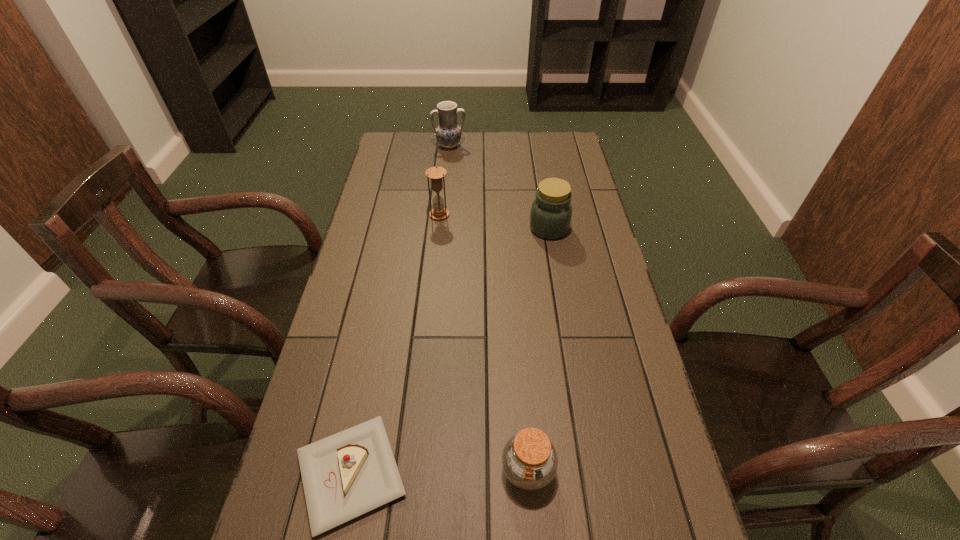
Where is `vacant area in the image that satisfies the following two spatial constraints: 1. on the front side of the taller jar; 2. on the left side of the pottery`? vacant area in the image that satisfies the following two spatial constraints: 1. on the front side of the taller jar; 2. on the left side of the pottery is located at coordinates (442, 228).

This screenshot has width=960, height=540. Find the location of `free space that satisfies the following two spatial constraints: 1. on the back side of the hourglass; 2. on the left side of the pottery`. free space that satisfies the following two spatial constraints: 1. on the back side of the hourglass; 2. on the left side of the pottery is located at coordinates (446, 146).